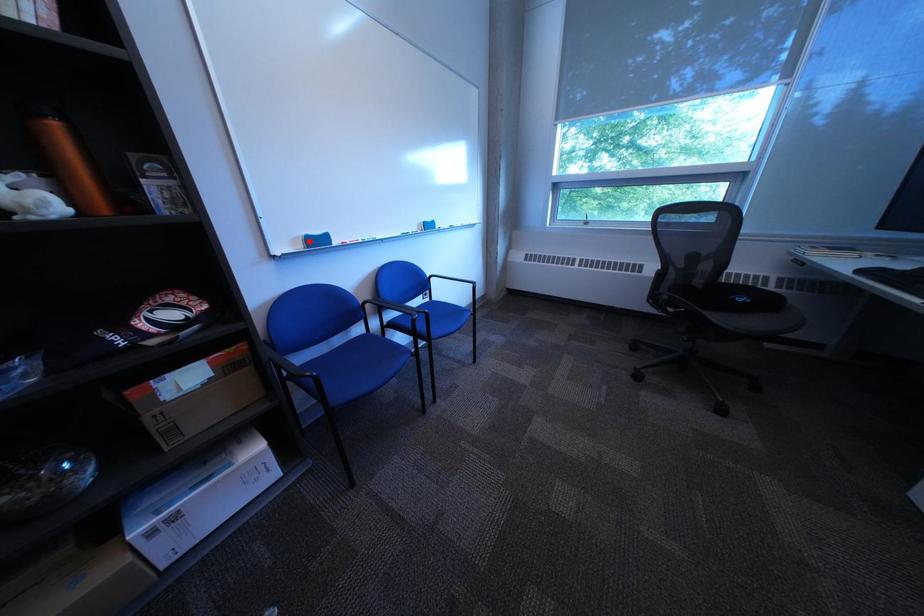
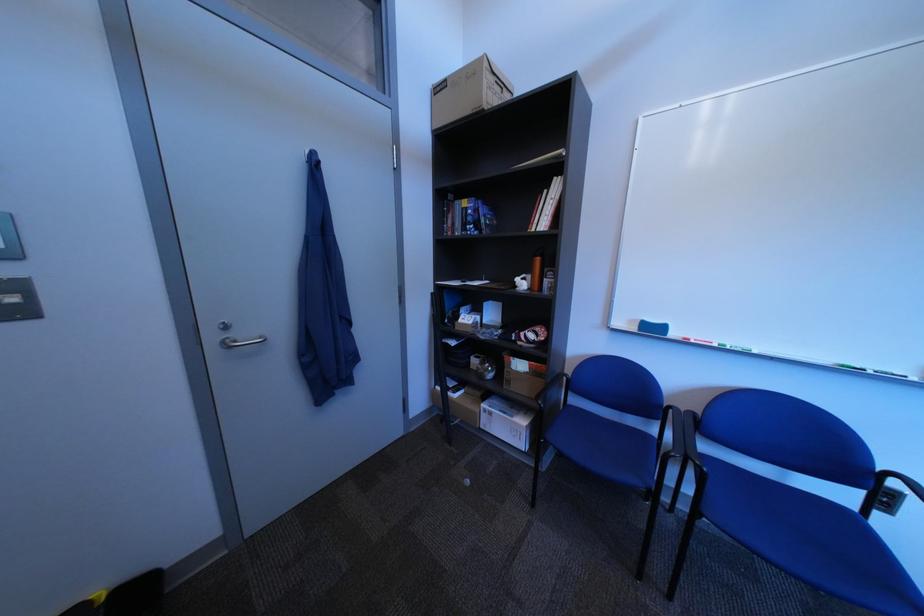
Question: I am providing you with two images of the same scene from different viewpoints. A red point is marked on the first image. At the location where the point appears in image 1, is it still visible in image 2?

Choices:
 (A) Yes
 (B) No

Answer: (A)